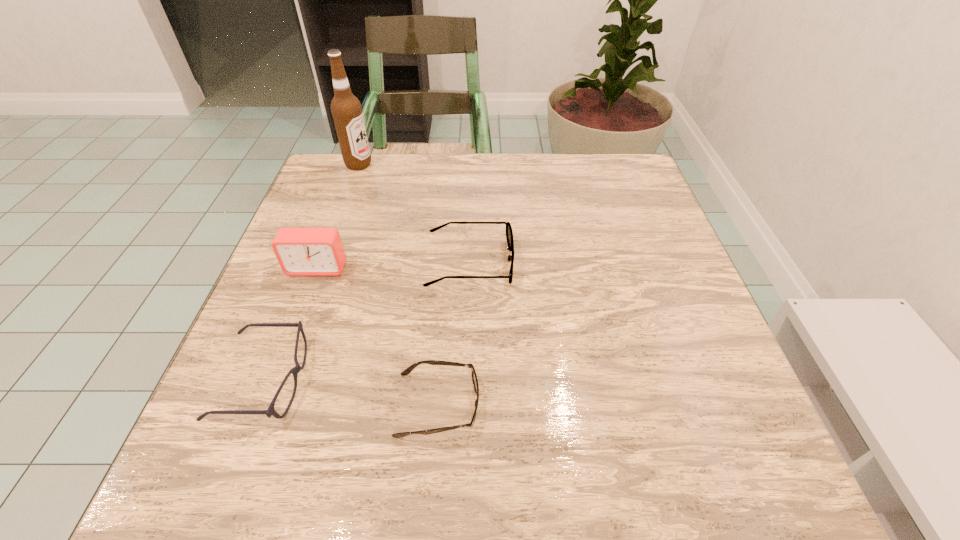
This screenshot has height=540, width=960. Identify the location of vacant space at the right edge of the desktop. (611, 224).

The image size is (960, 540). In the image, there is a desktop. What are the coordinates of `free space at the near left corner` in the screenshot? It's located at (276, 458).

The height and width of the screenshot is (540, 960). I want to click on free location at the far right corner of the desktop, so (x=596, y=189).

At what (x,y) coordinates should I click in order to perform the action: click on free space at the near right corner of the desktop. Please return your answer as a coordinate pair (x, y). This screenshot has height=540, width=960. Looking at the image, I should click on (678, 444).

The height and width of the screenshot is (540, 960). What are the coordinates of `vacant space that's between the shortest object and the leftmost spectacles` in the screenshot? It's located at [x=351, y=393].

I want to click on free point between the tallest object and the alarm clock, so click(x=338, y=216).

Identify the location of vacant area that lies between the farthest spectacles and the second tallest object. (394, 265).

At what (x,y) coordinates should I click in order to perform the action: click on free space between the farthest object and the shortest object. Please return your answer as a coordinate pair (x, y). Looking at the image, I should click on click(x=398, y=285).

The image size is (960, 540). Find the location of `free space between the farthest object and the farthest spectacles`. free space between the farthest object and the farthest spectacles is located at coordinates (414, 213).

Locate an element on the screen. vacant area between the alarm clock and the farthest spectacles is located at coordinates (394, 265).